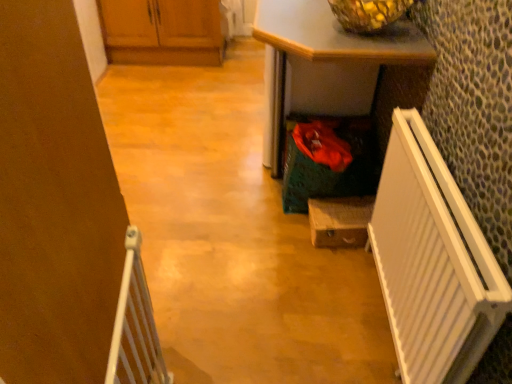
Question: In the image, is wooden cabinets at upper left, arranged as the 1th cabinetry when viewed from the left, on the left side or the right side of white plastic radiator at right, acting as the first radiator starting from the right?

Choices:
 (A) left
 (B) right

Answer: (A)

Question: Would you say wooden cabinets at upper left, which appears as the 2th cabinetry when ordered from the bottom, is inside or outside white plastic radiator at right, the second radiator viewed from the left?

Choices:
 (A) outside
 (B) inside

Answer: (A)

Question: Estimate the real-world distances between objects in this image. Which object is closer to the white plastic radiator at right, acting as the first radiator starting from the right?

Choices:
 (A) green textured desk at center
 (B) wooden drawer at center, marked as the 2th cabinetry in a left-to-right arrangement
 (C) wooden cabinets at upper left, which is the second cabinetry from front to back
 (D) white plastic radiator at left, positioned as the 1th radiator in left-to-right order

Answer: (B)

Question: Which object is positioned closest to the white plastic radiator at left, positioned as the 1th radiator in left-to-right order?

Choices:
 (A) white plastic radiator at right, the second radiator viewed from the left
 (B) green textured desk at center
 (C) wooden drawer at center, which is the second cabinetry in back-to-front order
 (D) wooden cabinets at upper left, which is the second cabinetry from front to back

Answer: (A)